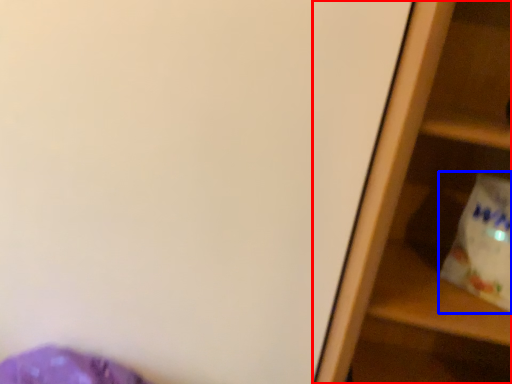
Question: Which object is closer to the camera taking this photo, shelf (highlighted by a red box) or grocery bag (highlighted by a blue box)?

Choices:
 (A) shelf
 (B) grocery bag

Answer: (A)